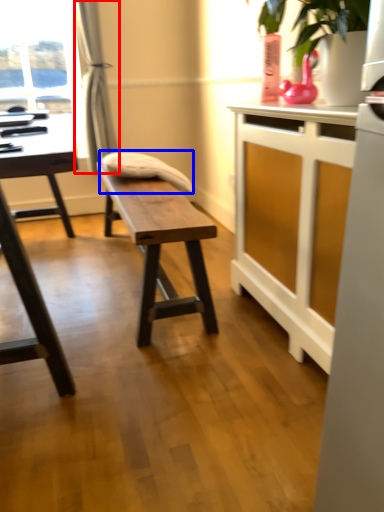
Question: Which point is further to the camera, curtain (highlighted by a red box) or swivel chair (highlighted by a blue box)?

Choices:
 (A) curtain
 (B) swivel chair

Answer: (A)